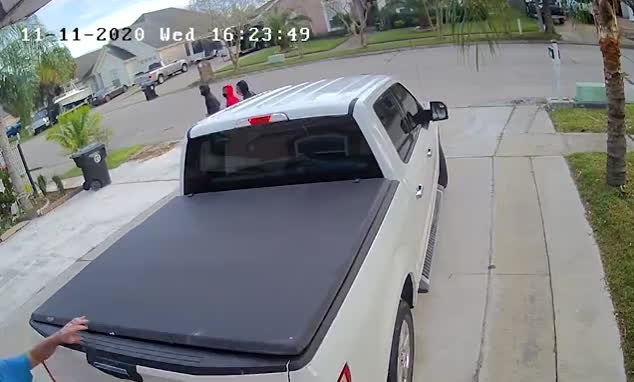
Where is `trashcan bin`? trashcan bin is located at coordinates (99, 163).